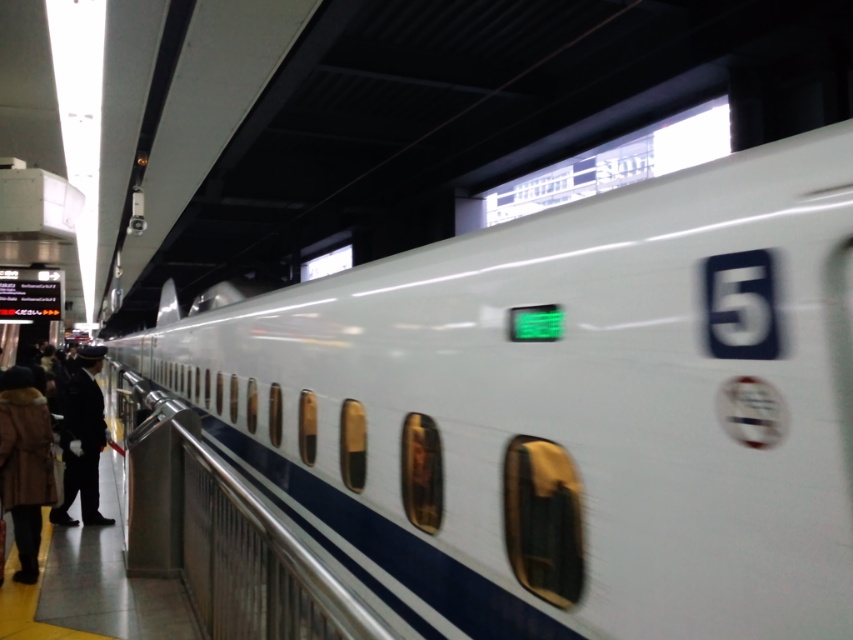
Question: Can you confirm if white glossy train at center is wider than dark blue uniform at left?

Choices:
 (A) yes
 (B) no

Answer: (A)

Question: Which of the following is the farthest from the observer?

Choices:
 (A) (74, 374)
 (B) (701, 509)

Answer: (A)

Question: Which object is positioned farthest from the white glossy train at center?

Choices:
 (A) brown fuzzy coat at lower left
 (B) dark blue uniform at left

Answer: (B)

Question: Can you confirm if white glossy train at center is positioned to the right of brown fuzzy coat at lower left?

Choices:
 (A) yes
 (B) no

Answer: (A)

Question: Which object is farther from the camera taking this photo?

Choices:
 (A) white glossy train at center
 (B) dark blue uniform at left

Answer: (B)

Question: Does white glossy train at center appear under brown fuzzy coat at lower left?

Choices:
 (A) yes
 (B) no

Answer: (B)